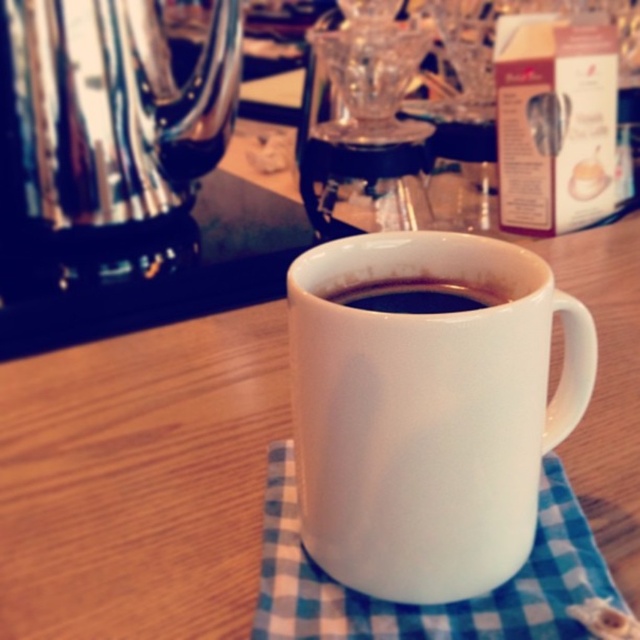
Does white ceramic mug at center have a lesser width compared to white checkered cloth at center?

Yes.

Who is lower down, white ceramic mug at center or white checkered cloth at center?

white checkered cloth at center is below.

Is point (342, 448) positioned after point (333, 605)?

No, (342, 448) is in front of (333, 605).

In order to click on white ceramic mug at center in this screenshot , I will do `click(428, 410)`.

Can you confirm if white ceramic mug at center is positioned to the right of black glossy coffee at center?

Correct, you'll find white ceramic mug at center to the right of black glossy coffee at center.

Who is more distant from viewer, [548,348] or [384,310]?

The point [384,310] is more distant.

Find the location of `white ceramic mug at center`. white ceramic mug at center is located at coordinates (428, 410).

Who is higher up, white checkered cloth at center or black glossy coffee at center?

Positioned higher is black glossy coffee at center.

Where is `white checkered cloth at center`? white checkered cloth at center is located at coordinates (429, 604).